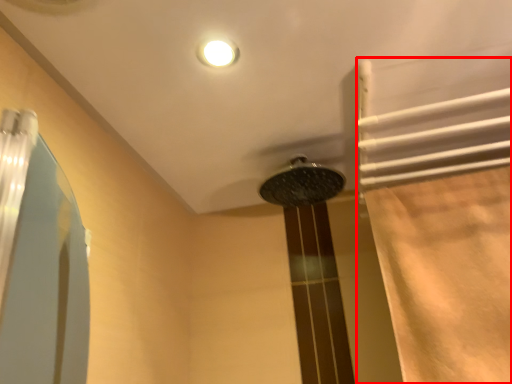
Question: From the image's perspective, considering the relative positions of shower curtain (annotated by the red box) and shower in the image provided, where is shower curtain (annotated by the red box) located with respect to the staircase?

Choices:
 (A) above
 (B) below

Answer: (B)